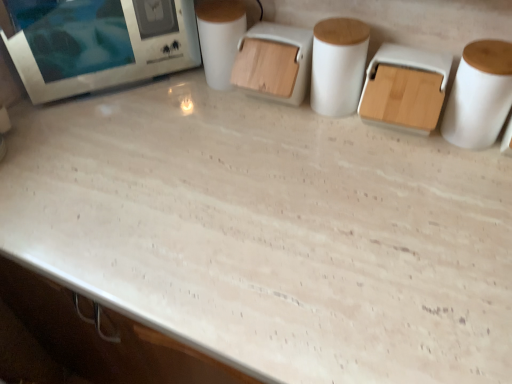
Image resolution: width=512 pixels, height=384 pixels. Identify the location of free space to the left of wooden lid container at center. (185, 112).